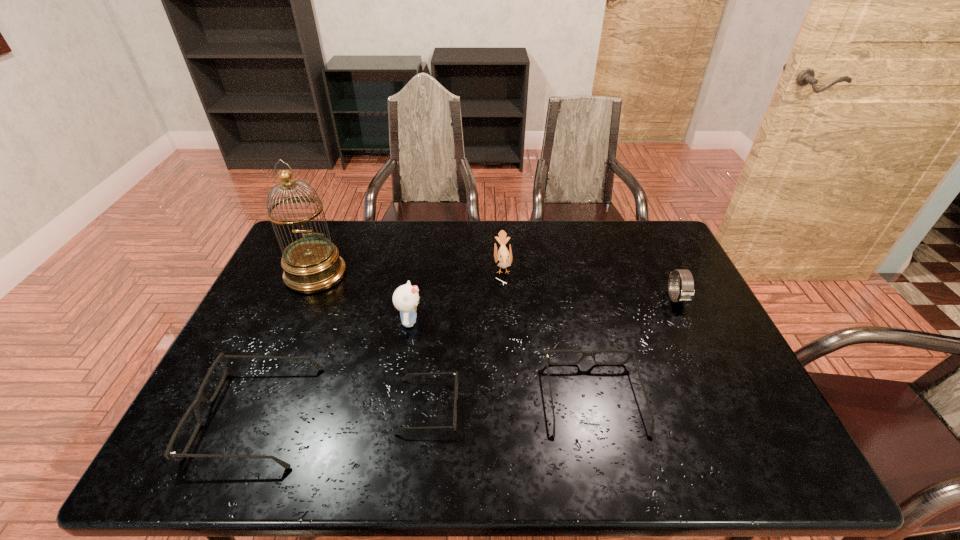
Find the location of a particular element. unoccupied area between the fourth nearest object and the leftmost spectacles is located at coordinates (333, 368).

Find the location of a particular element. free area in between the tallest object and the fourth farthest object is located at coordinates (363, 298).

Find the location of `object that ranks as the closest to the third object from right to left`. object that ranks as the closest to the third object from right to left is located at coordinates (406, 297).

Locate an element on the screen. The image size is (960, 540). object that is the fourth closest one to the watch is located at coordinates (406, 297).

What are the coordinates of `spectacles that is the nearest to the kitten` in the screenshot? It's located at (456, 376).

Identify the location of the second closest spectacles to the leftmost spectacles. The image size is (960, 540). (631, 354).

Locate an element on the screen. This screenshot has height=540, width=960. blank area in the image that satisfies the following two spatial constraints: 1. on the face of the watch; 2. on the front-facing side of the second spectacles from left to right is located at coordinates (729, 406).

You are a GUI agent. You are given a task and a screenshot of the screen. Output one action in this format:
    pyautogui.click(x=<x>, y=<y>)
    Task: Click on the free spot that satisfies the following two spatial constraints: 1. on the front-facing side of the second shortest object; 2. on the front-facing side of the fourth nearest object
    
    Given the screenshot: What is the action you would take?
    pyautogui.click(x=577, y=321)

You are a GUI agent. You are given a task and a screenshot of the screen. Output one action in this format:
    pyautogui.click(x=<x>, y=<y>)
    Task: Click on the vacant area that satisfies the following two spatial constraints: 1. at the beak of the bird; 2. on the front-facing side of the sixth tallest object
    
    Given the screenshot: What is the action you would take?
    pyautogui.click(x=511, y=399)